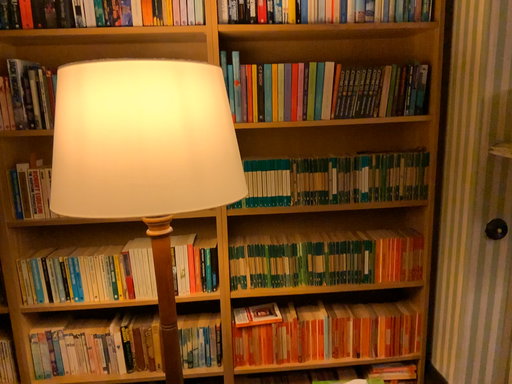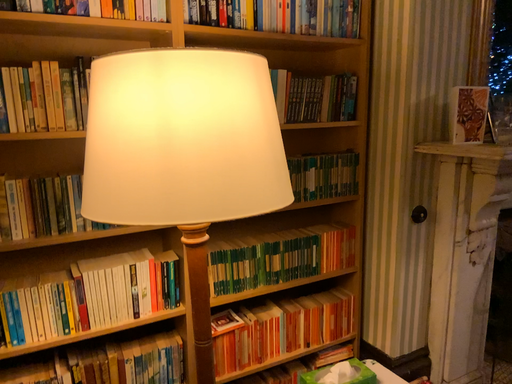
Question: Which way did the camera rotate in the video?

Choices:
 (A) rotated left
 (B) rotated right

Answer: (B)